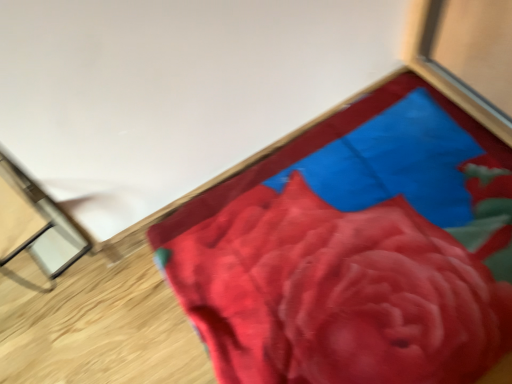
Describe the element at coordinates (337, 293) in the screenshot. The width and height of the screenshot is (512, 384). I see `velvety red rose at center` at that location.

The width and height of the screenshot is (512, 384). Find the location of `velvety red rose at center`. velvety red rose at center is located at coordinates (337, 293).

Where is `velvety red rose at center`? Image resolution: width=512 pixels, height=384 pixels. velvety red rose at center is located at coordinates (337, 293).